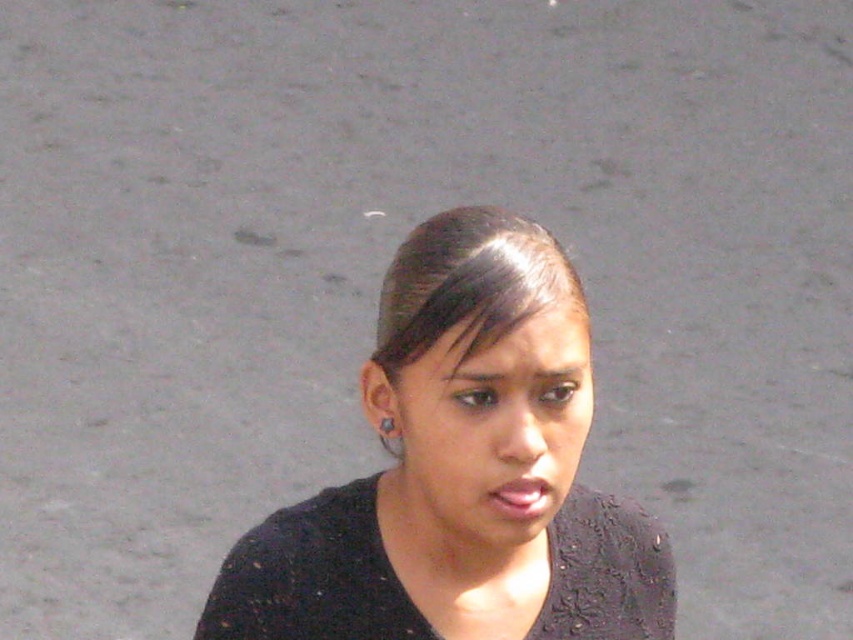
Question: In this image, where is black matte shirt at center located relative to silver metallic earring at upper left?

Choices:
 (A) right
 (B) left

Answer: (A)

Question: Among these objects, which one is nearest to the camera?

Choices:
 (A) silver metallic earring at upper left
 (B) black matte shirt at center

Answer: (B)

Question: Is the position of smooth skin face at center less distant than that of silver metallic earring at upper left?

Choices:
 (A) no
 (B) yes

Answer: (B)

Question: From the image, what is the correct spatial relationship of black matte shirt at center in relation to silver metallic earring at upper left?

Choices:
 (A) left
 (B) right

Answer: (B)

Question: Estimate the real-world distances between objects in this image. Which object is closer to the black matte shirt at center?

Choices:
 (A) smooth skin face at center
 (B) silver metallic earring at upper left

Answer: (A)

Question: Which object is closer to the camera taking this photo?

Choices:
 (A) silver metallic earring at upper left
 (B) black matte shirt at center

Answer: (B)